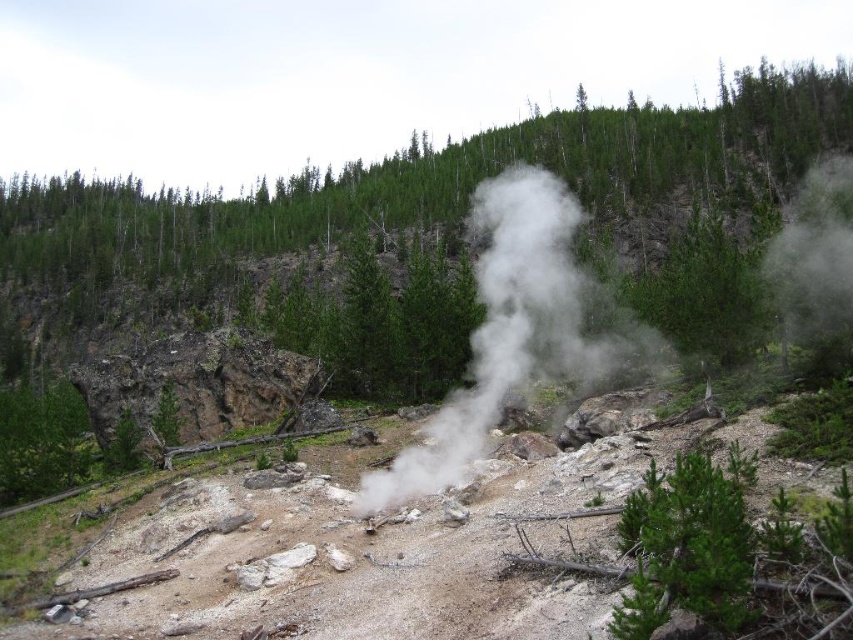
You are a hiker trying to determine the safest path through the geothermal area. You see the white steam at center and the green matte tree at center. Which object is closer to you, and why?

The white steam at center is closer to you because it is in front of the green matte tree at center, meaning it blocks the view of the tree, indicating it is nearer in the visual plane.

You are a hiker who wants to avoid the steam to prevent getting wet. You see the white steam at center and the green matte tree at center. Which one should you stand behind to stay dry?

The white steam at center is above the green matte tree at center, so standing behind the green matte tree at center would place you below the steam, keeping you dry.

You are a geologist standing at the edge of this geothermal area. You need to collect a sample from the white steam at center. Given that your sampling tool has a maximum reach of 20 meters, can you safely collect the sample without moving closer?

The distance between you and the white steam at center is 20.93 meters, which exceeds the 20 meter reach of your tool. Therefore, you cannot safely collect the sample without moving closer.